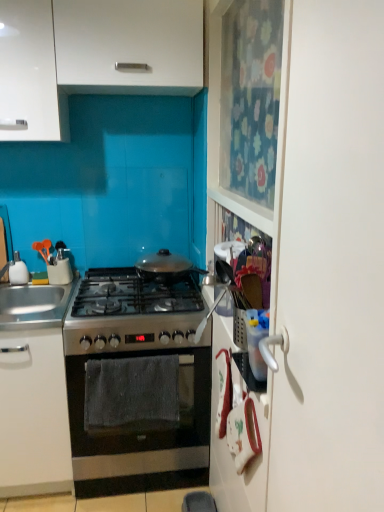
Question: Is white glossy soap dispenser at left far away from white glossy cabinet at upper left, the second cabinetry when ordered from top to bottom?

Choices:
 (A) yes
 (B) no

Answer: (B)

Question: Considering the relative sizes of white glossy soap dispenser at left and white glossy cabinet at upper left, the second cabinetry when ordered from top to bottom, in the image provided, is white glossy soap dispenser at left shorter than white glossy cabinet at upper left, the second cabinetry when ordered from top to bottom,?

Choices:
 (A) no
 (B) yes

Answer: (B)

Question: Considering the relative sizes of white glossy soap dispenser at left and white glossy cabinet at upper left, which is the 2th cabinetry from bottom to top, in the image provided, is white glossy soap dispenser at left taller than white glossy cabinet at upper left, which is the 2th cabinetry from bottom to top,?

Choices:
 (A) no
 (B) yes

Answer: (A)

Question: Can you see white glossy soap dispenser at left touching white glossy cabinet at upper left, which is the 2th cabinetry from bottom to top?

Choices:
 (A) no
 (B) yes

Answer: (A)

Question: Does white glossy soap dispenser at left have a smaller size compared to white glossy cabinet at upper left, the second cabinetry when ordered from top to bottom?

Choices:
 (A) yes
 (B) no

Answer: (A)

Question: Considering the relative sizes of white glossy soap dispenser at left and white glossy cabinet at upper left, the second cabinetry when ordered from top to bottom, in the image provided, is white glossy soap dispenser at left bigger than white glossy cabinet at upper left, the second cabinetry when ordered from top to bottom,?

Choices:
 (A) yes
 (B) no

Answer: (B)

Question: Is white glossy soap dispenser at left closer to the viewer compared to white matte cabinet at upper left, which is the 1th cabinetry from top to bottom?

Choices:
 (A) no
 (B) yes

Answer: (A)

Question: From the image's perspective, is white glossy soap dispenser at left on white matte cabinet at upper left, which is the 1th cabinetry from top to bottom?

Choices:
 (A) yes
 (B) no

Answer: (B)

Question: Considering the relative sizes of white glossy soap dispenser at left and white matte cabinet at upper left, which is the 1th cabinetry from top to bottom, in the image provided, is white glossy soap dispenser at left taller than white matte cabinet at upper left, which is the 1th cabinetry from top to bottom,?

Choices:
 (A) yes
 (B) no

Answer: (B)

Question: Does white glossy soap dispenser at left have a lesser width compared to white matte cabinet at upper left, the third cabinetry in the bottom-to-top sequence?

Choices:
 (A) no
 (B) yes

Answer: (B)

Question: Is white glossy soap dispenser at left smaller than white matte cabinet at upper left, the third cabinetry in the bottom-to-top sequence?

Choices:
 (A) yes
 (B) no

Answer: (A)

Question: Does white glossy soap dispenser at left appear on the right side of white matte cabinet at upper left, the third cabinetry in the bottom-to-top sequence?

Choices:
 (A) no
 (B) yes

Answer: (A)

Question: Can you confirm if stainless steel oven at center is thinner than white glossy soap dispenser at left?

Choices:
 (A) yes
 (B) no

Answer: (B)